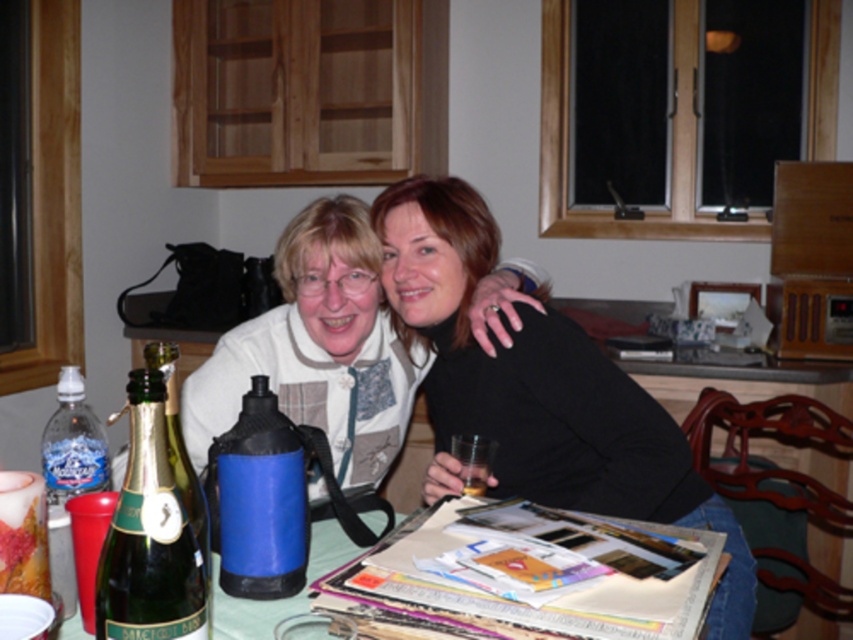
You are a delivery person who needs to place a small package between the black matte sweater at center and the green glass bottle at lower left. Can you fit it there if the package is 24 inches long?

The black matte sweater at center is 23.84 inches from the green glass bottle at lower left. Since the package is 24 inches long, it would not fit in the space between them as the distance is slightly shorter than the package length.

You are a guest at this dinner and need to choose a beverage container. The green glass bottle at lower left and the blue matte water bottle at center are both available. Which one has a greater capacity based on their height?

The green glass bottle at lower left is much taller than the blue matte water bottle at center, so it likely has a greater capacity.

You are designing a layout for a magazine spread and need to place a caption under the image. The caption must mention both the black matte sweater at center and the green glass bottle at lower left. Since space is limited, you want to ensure the caption is positioned so it doesn t overlap any important elements. Considering their sizes, where should you place the caption?

The black matte sweater at center is taller than the green glass bottle at lower left, so placing the caption below the green glass bottle at lower left would leave more vertical space for the text without overlapping the taller sweater.